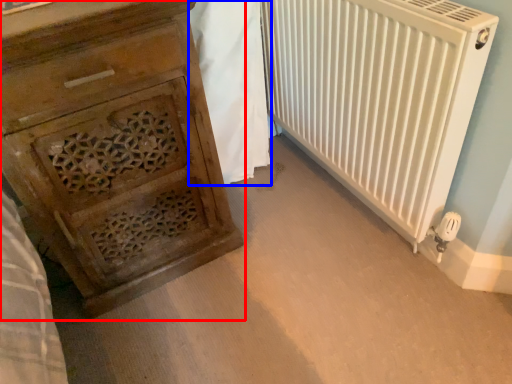
Question: Which object appears farthest to the camera in this image, chest of drawers (highlighted by a red box) or blanket (highlighted by a blue box)?

Choices:
 (A) chest of drawers
 (B) blanket

Answer: (B)